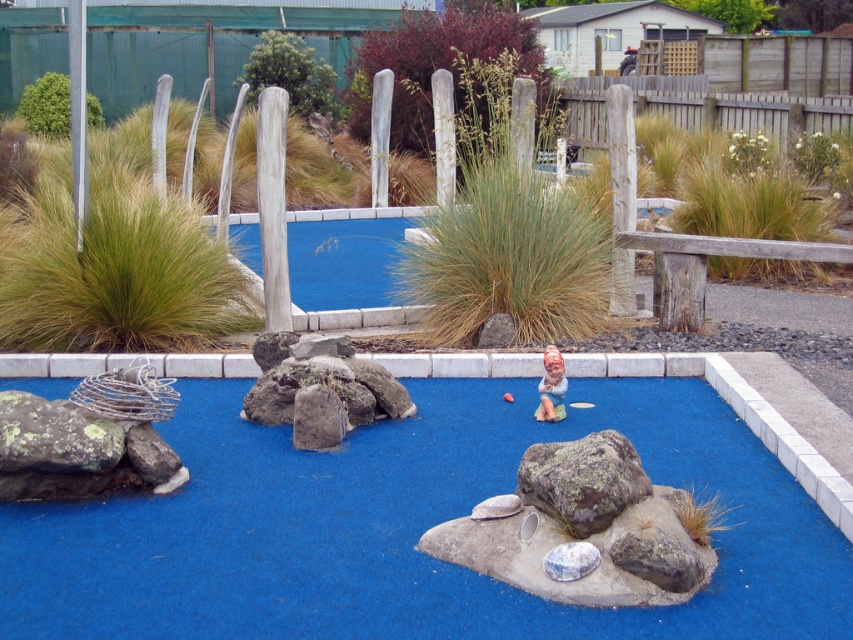
You are a miniature golfer trying to hit your ball over the rocks. Which rock, the green mossy rock at center or the brown rough rock at center, is taller and requires a higher shot to clear?

The green mossy rock at center is taller than the brown rough rock at center, so you need to aim higher to clear it.

You are playing miniature golf and need to hit the ball from the starting point to the hole. The starting point is at point (136,552) and the hole is at point (563,403). Based on the scene description, which point is closer to you as you stand at the starting position?

Point (136,552) is in front of point (563,403), so the starting point is closer to you. The hole at point (563,403) is further away from your current position.